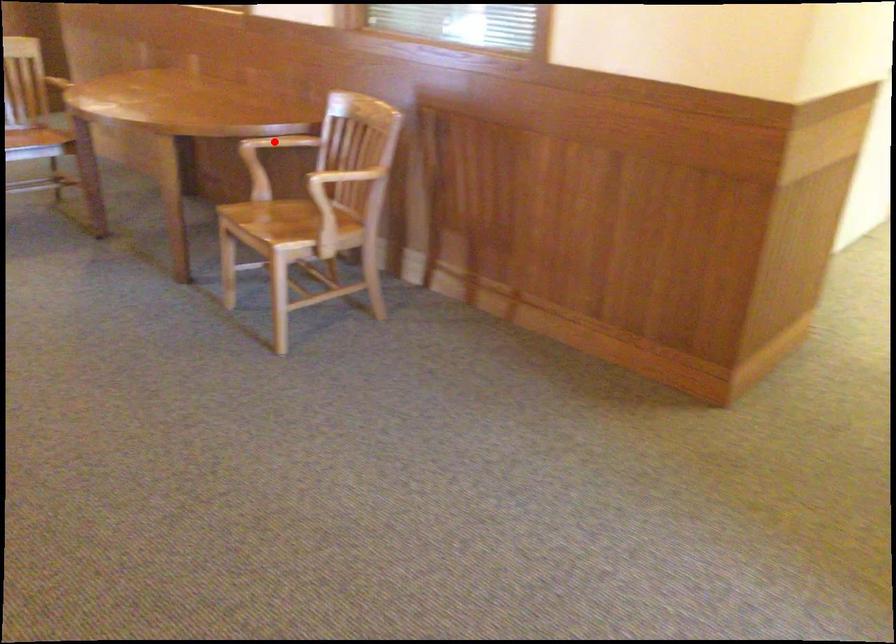
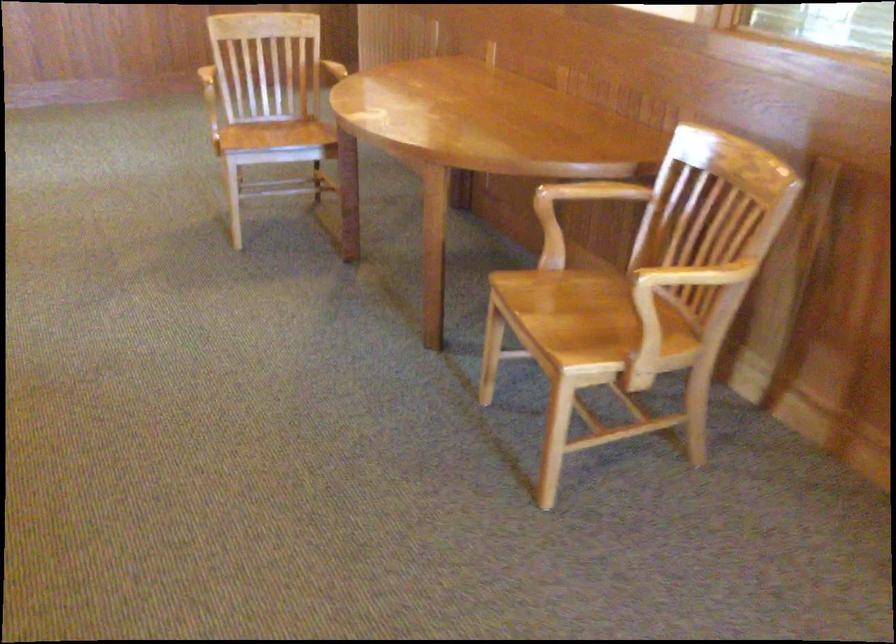
In the second image, find the point that corresponds to the highlighted location in the first image.

(587, 194)